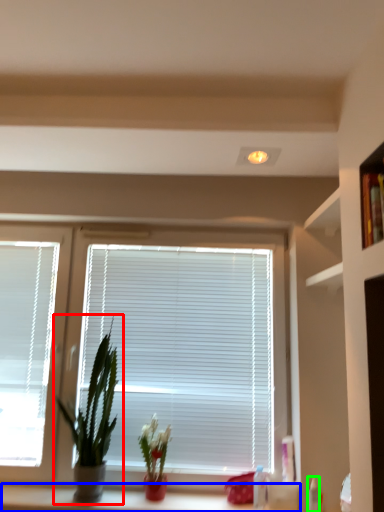
Question: Based on their relative distances, which object is nearer to houseplant (highlighted by a red box)? Choose from counter (highlighted by a blue box) and toiletry (highlighted by a green box).

Choices:
 (A) counter
 (B) toiletry

Answer: (A)